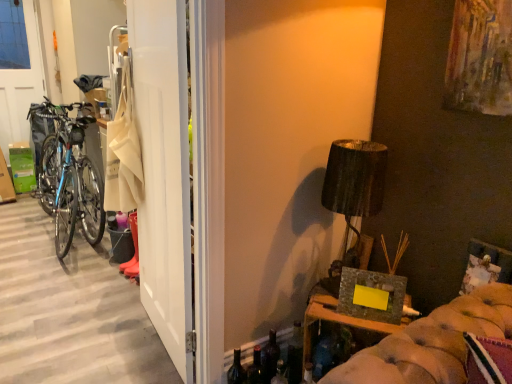
What are the coordinates of `vacant area situated to the left side of white matte door at left` in the screenshot? It's located at (96, 332).